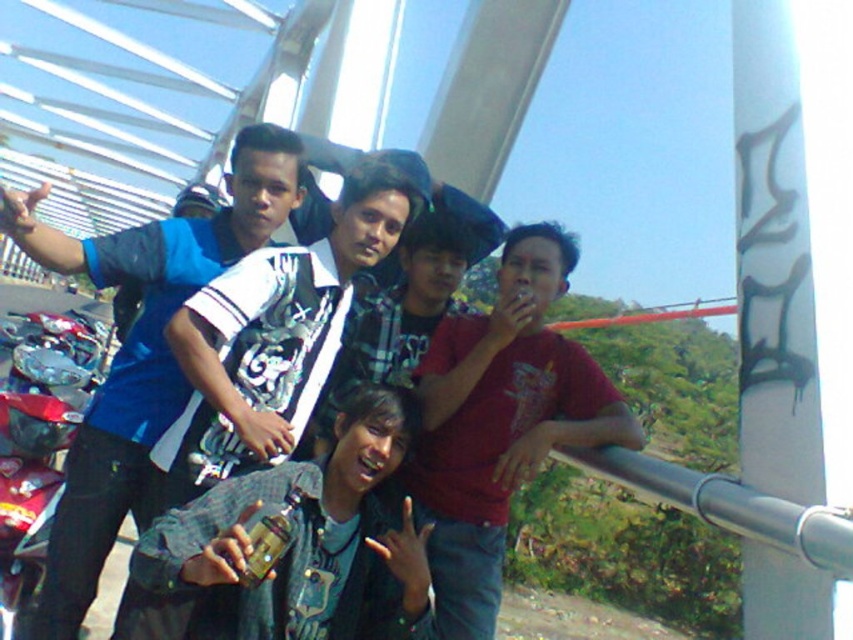
Consider the image. Who is higher up, denim jacket at center or blue fabric shirt at left?

Positioned higher is blue fabric shirt at left.

Who is positioned more to the left, denim jacket at center or blue fabric shirt at left?

From the viewer's perspective, blue fabric shirt at left appears more on the left side.

Looking at this image, who is more distant from viewer, [180,596] or [45,602]?

The point [45,602] is behind.

Image resolution: width=853 pixels, height=640 pixels. Identify the location of denim jacket at center. (294, 547).

Is matte red shirt at center below blue fabric shirt at left?

Correct, matte red shirt at center is located below blue fabric shirt at left.

Find the location of a particular element. matte red shirt at center is located at coordinates (502, 422).

Between point (383, 611) and point (541, 403), which one is positioned in front?

Point (383, 611) is in front.

Is point (288, 461) more distant than point (450, 456)?

No, (288, 461) is in front of (450, 456).

Identify the location of denim jacket at center. The width and height of the screenshot is (853, 640). (294, 547).